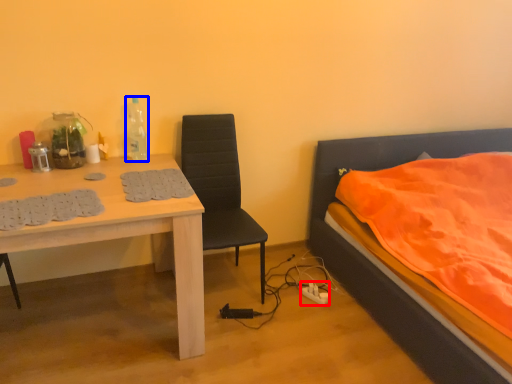
Question: Which object is further to the camera taking this photo, power outlet (highlighted by a red box) or bottle (highlighted by a blue box)?

Choices:
 (A) power outlet
 (B) bottle

Answer: (A)